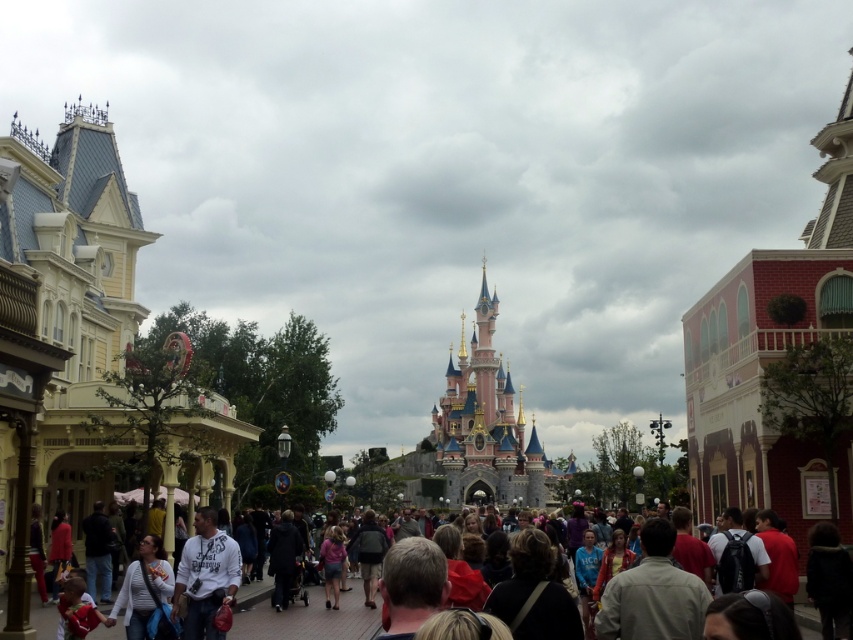
Question: Which point is closer to the camera?

Choices:
 (A) (514, 445)
 (B) (538, 621)
 (C) (120, 588)

Answer: (B)

Question: Which point is farther to the camera?

Choices:
 (A) (376, 550)
 (B) (39, 534)

Answer: (A)

Question: Does white cotton shirt at lower left appear on the left side of pink fabric skirt at center?

Choices:
 (A) yes
 (B) no

Answer: (A)

Question: Does dark brown leather jacket at center appear over matte black backpack at center?

Choices:
 (A) no
 (B) yes

Answer: (B)

Question: Does dark brown leather jacket at center have a larger size compared to matte black backpack at center?

Choices:
 (A) no
 (B) yes

Answer: (A)

Question: Which point is closer to the camera?

Choices:
 (A) matte black jacket at lower left
 (B) pink fabric skirt at center
 (C) dark brown leather jacket at center
 (D) matte black backpack at center

Answer: (C)